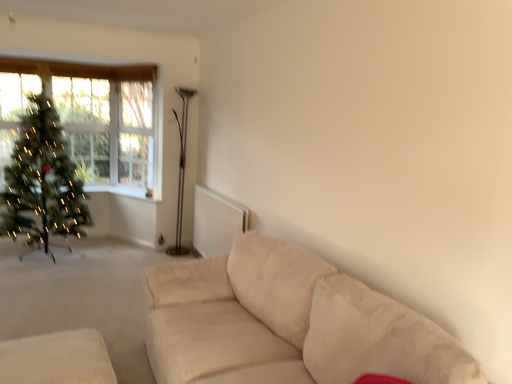
Question: Would you say clear glass window at upper left is to the left or to the right of beige fabric ottoman at lower left in the picture?

Choices:
 (A) left
 (B) right

Answer: (A)

Question: From their relative heights in the image, would you say clear glass window at upper left is taller or shorter than beige fabric ottoman at lower left?

Choices:
 (A) short
 (B) tall

Answer: (B)

Question: Which object is positioned farthest from the clear glass window at upper left?

Choices:
 (A) metallic silver floor lamp at center
 (B) green matte christmas tree at left
 (C) beige fabric ottoman at lower left

Answer: (C)

Question: Estimate the real-world distances between objects in this image. Which object is closer to the green matte christmas tree at left?

Choices:
 (A) clear glass window at upper left
 (B) beige fabric ottoman at lower left
 (C) metallic silver floor lamp at center

Answer: (A)